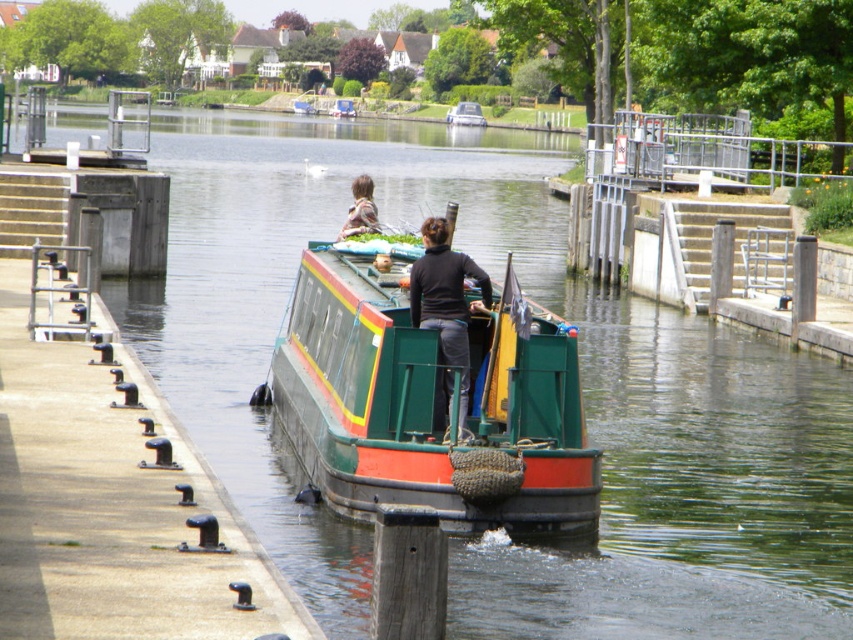
What do you see at coordinates (428, 400) in the screenshot? The width and height of the screenshot is (853, 640). I see `green painted wood boat at center` at bounding box center [428, 400].

Does green painted wood boat at center have a lesser height compared to black matte jacket at center?

Indeed, green painted wood boat at center has a lesser height compared to black matte jacket at center.

The height and width of the screenshot is (640, 853). What do you see at coordinates (428, 400) in the screenshot?
I see `green painted wood boat at center` at bounding box center [428, 400].

This screenshot has width=853, height=640. What are the coordinates of `green painted wood boat at center` in the screenshot? It's located at pos(428,400).

Does point (445, 307) come farther from viewer compared to point (451, 122)?

That is False.

This screenshot has width=853, height=640. What do you see at coordinates (445, 310) in the screenshot? I see `black matte jacket at center` at bounding box center [445, 310].

You are a GUI agent. You are given a task and a screenshot of the screen. Output one action in this format:
    pyautogui.click(x=<x>, y=<y>)
    Task: Click on the black matte jacket at center
    
    Given the screenshot: What is the action you would take?
    pyautogui.click(x=445, y=310)

Does green painted wood at left lie in front of green painted wood boat at center?

Yes, it is in front of green painted wood boat at center.

Between point (134, 545) and point (341, 378), which one is positioned behind?

The point (341, 378) is more distant.

This screenshot has width=853, height=640. I want to click on green painted wood at left, so click(x=111, y=506).